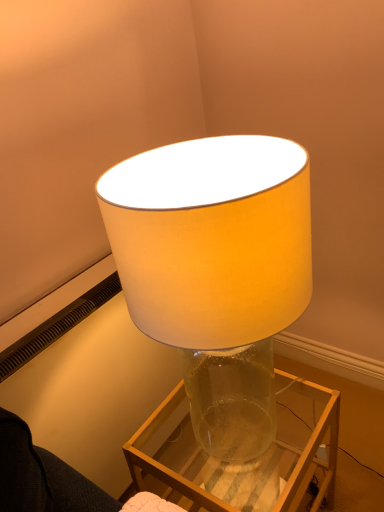
What do you see at coordinates (216, 269) in the screenshot? I see `translucent glass lamp at center` at bounding box center [216, 269].

Based on the photo, measure the distance between translucent glass lamp at center and camera.

The depth of translucent glass lamp at center is 19.62 inches.

The image size is (384, 512). What are the coordinates of `translucent glass lamp at center` in the screenshot? It's located at (216, 269).

Image resolution: width=384 pixels, height=512 pixels. In order to click on translucent glass lamp at center in this screenshot , I will do `click(216, 269)`.